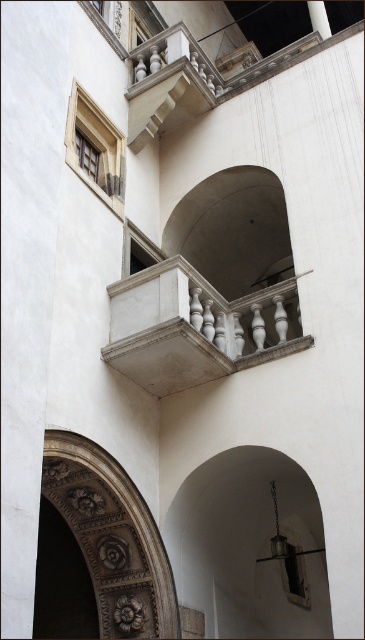
You are an architect designing a new building inspired by classical architecture. You need to ensure that the white marble balcony at center and the carved stone archway at lower left maintain proportional harmony. Given their widths, which object should be placed in a position that requires a wider structure for structural stability?

The white marble balcony at center should be placed in the position requiring a wider structure because its width surpasses that of the carved stone archway at lower left, ensuring it can handle the necessary load and maintain structural stability.

You are an architect inspecting the building. You notice the white marble balcony at center and the carved stone archway at lower left. Which of these two elements is located higher up in the structure?

The white marble balcony at center is positioned over the carved stone archway at lower left, meaning it is higher up in the structure.

Looking at this image, you are an architect examining the building facade. You notice the white marble balcony at center and the carved stone archway at lower left. Which of these two features is located to the right of the other?

The white marble balcony at center is positioned on the right side of carved stone archway at lower left.